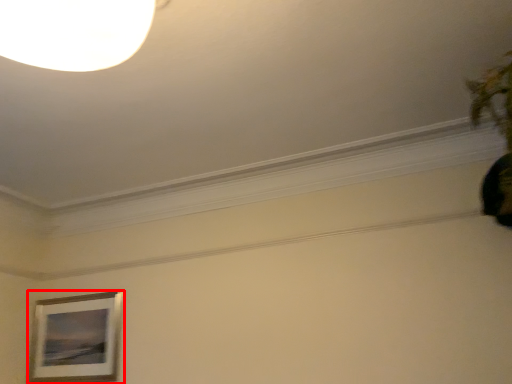
Question: From the image, what is the correct spatial relationship of picture frame (annotated by the red box) in relation to plant?

Choices:
 (A) left
 (B) right

Answer: (A)